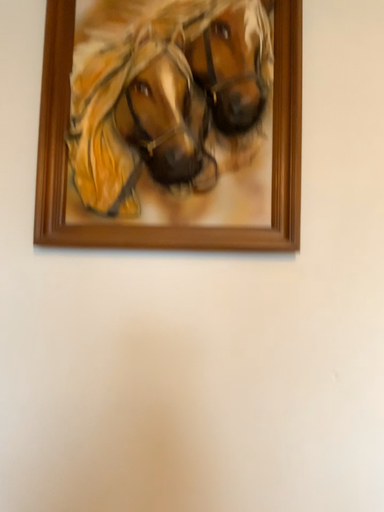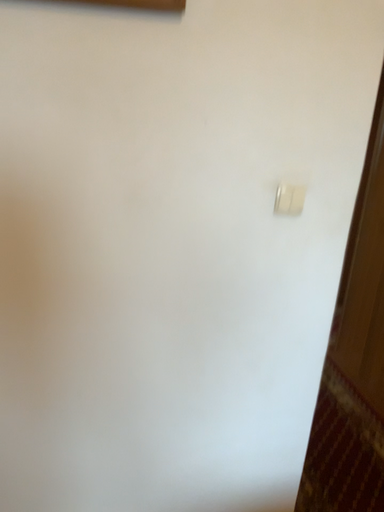
Question: How did the camera likely rotate when shooting the video?

Choices:
 (A) rotated downward
 (B) rotated upward

Answer: (A)